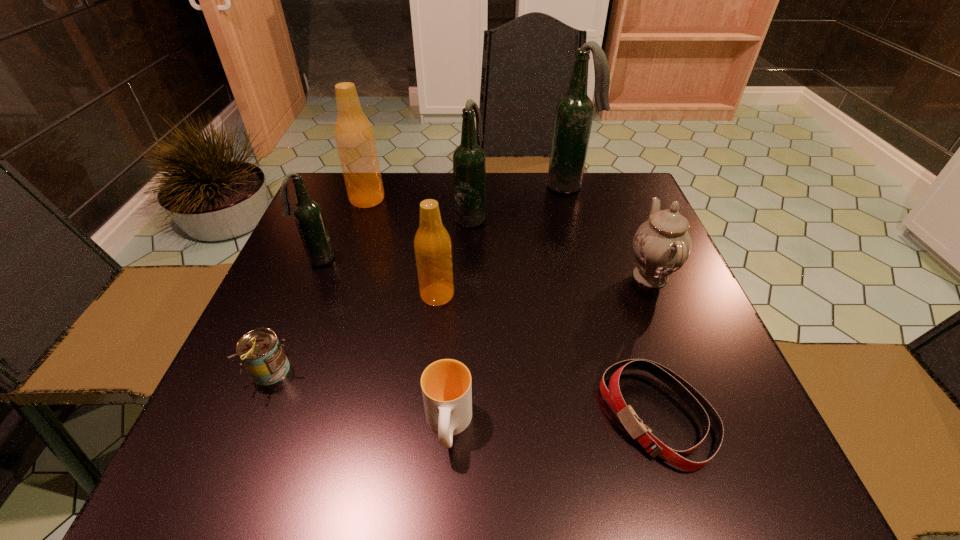
The height and width of the screenshot is (540, 960). Find the location of `vacant space that's between the sixth tallest object and the second dark beer bottle from right to left`. vacant space that's between the sixth tallest object and the second dark beer bottle from right to left is located at coordinates (561, 246).

Where is `vacant area that lies between the sixth tallest object and the right tan beer bottle`? Image resolution: width=960 pixels, height=540 pixels. vacant area that lies between the sixth tallest object and the right tan beer bottle is located at coordinates (543, 285).

Find the location of a particular element. The height and width of the screenshot is (540, 960). the seventh closest object relative to the nearest dark beer bottle is located at coordinates (706, 414).

Locate an element on the screen. object that stands as the third closest to the chinaware is located at coordinates (469, 161).

Identify which beer bottle is the closest to the can. Please provide its 2D coordinates. Your answer should be formatted as a tuple, i.e. [(x, y)], where the tuple contains the x and y coordinates of a point satisfying the conditions above.

[(433, 250)]

This screenshot has width=960, height=540. I want to click on beer bottle that is the fifth closest to the pink dog collar, so click(x=354, y=136).

Identify which dark beer bottle is the closest to the seventh tallest object. Please provide its 2D coordinates. Your answer should be formatted as a tuple, i.e. [(x, y)], where the tuple contains the x and y coordinates of a point satisfying the conditions above.

[(307, 213)]

Locate an element on the screen. The image size is (960, 540). dark beer bottle that is the second closest one to the farther tan beer bottle is located at coordinates (469, 161).

The image size is (960, 540). Identify the location of vacant point that satisfies the following two spatial constraints: 1. on the spout of the chinaware; 2. on the front side of the pink dog collar. (708, 417).

At what (x,y) coordinates should I click in order to perform the action: click on free spot that satisfies the following two spatial constraints: 1. on the back side of the can; 2. on the right side of the leftmost dark beer bottle. Please return your answer as a coordinate pair (x, y). Looking at the image, I should click on (318, 260).